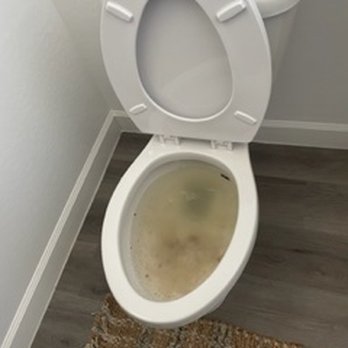
Locate an element on the screen. wood like floor is located at coordinates coord(304,270), coord(68,285).